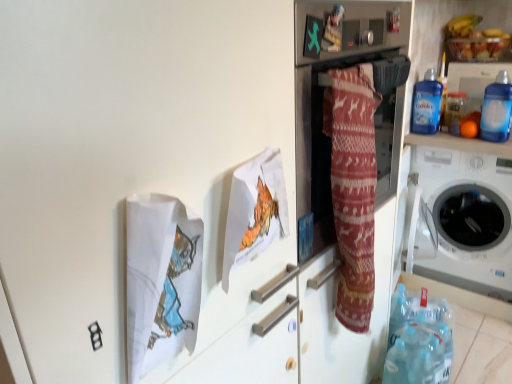
Where is `free space to the left of orange matte at upper right`? This screenshot has height=384, width=512. free space to the left of orange matte at upper right is located at coordinates (441, 135).